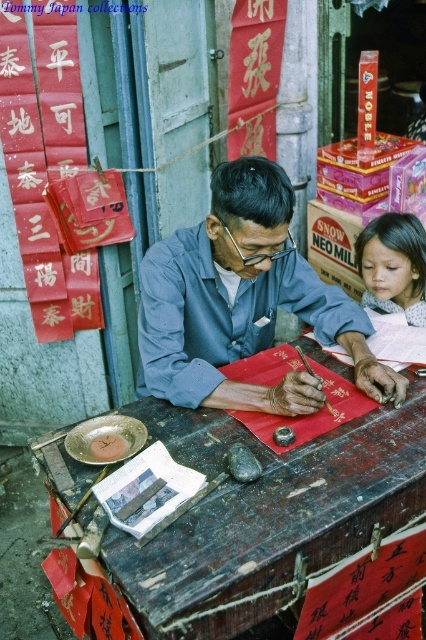
You are standing in front of the shop and want to know how far the point marked at coordinates [270,544] is from you. Can you determine the distance?

The point marked at coordinates [270,544] is 4.43 feet away from you.

Based on the photo, you are a customer in the shop and want to place an order for a custom calligraphy piece. The shopkeeper tells you that the smooth paper scroll at center is used for writing, while the wooden table at center is for placing items. Where should you put your items to ensure they are not in the way of the calligrapher?

You should place your items on the wooden table at center because it is below the smooth paper scroll at center, so placing items there will not interfere with the calligrapher who is using the scroll above.